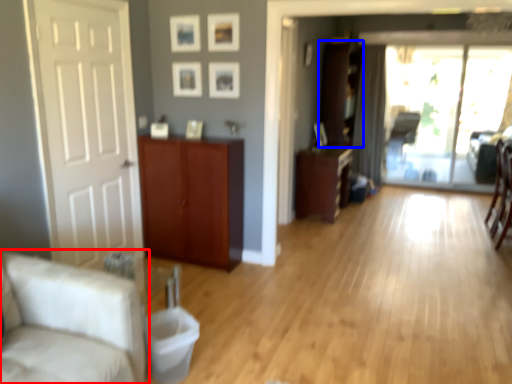
Question: Which of the following is the farthest to the observer, studio couch (highlighted by a red box) or cabinetry (highlighted by a blue box)?

Choices:
 (A) studio couch
 (B) cabinetry

Answer: (B)